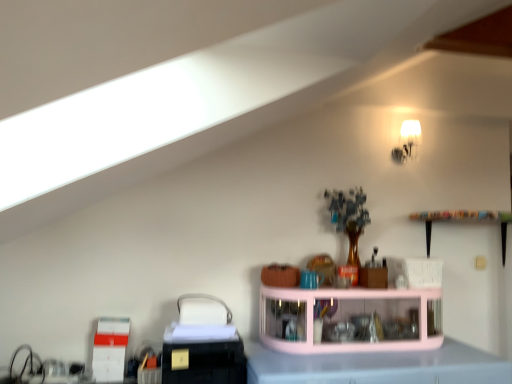
Question: Do you think pink glossy counter top at center is within white frosted glass lampshade at upper right, or outside of it?

Choices:
 (A) inside
 (B) outside

Answer: (B)

Question: From the image's perspective, is pink glossy counter top at center positioned above or below white frosted glass lampshade at upper right?

Choices:
 (A) above
 (B) below

Answer: (B)

Question: Which object is positioned farthest from the white frosted glass lampshade at upper right?

Choices:
 (A) pink glass shelf at center
 (B) pink glossy counter top at center

Answer: (B)

Question: Considering the real-world distances, which object is closest to the pink glass shelf at center?

Choices:
 (A) white frosted glass lampshade at upper right
 (B) pink glossy counter top at center

Answer: (B)